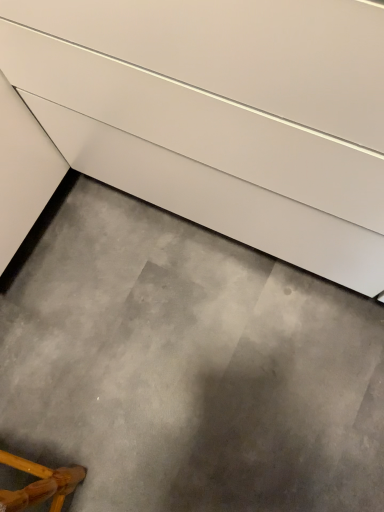
The width and height of the screenshot is (384, 512). In order to click on vacant space behind wooden chair at lower left in this screenshot , I will do `click(46, 393)`.